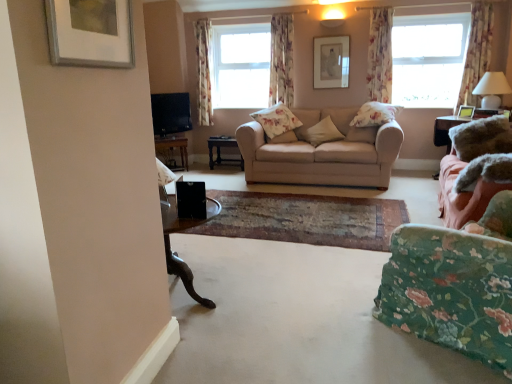
Locate an element on the screen. vacant position to the left of floral fabric chair at lower right is located at coordinates (318, 305).